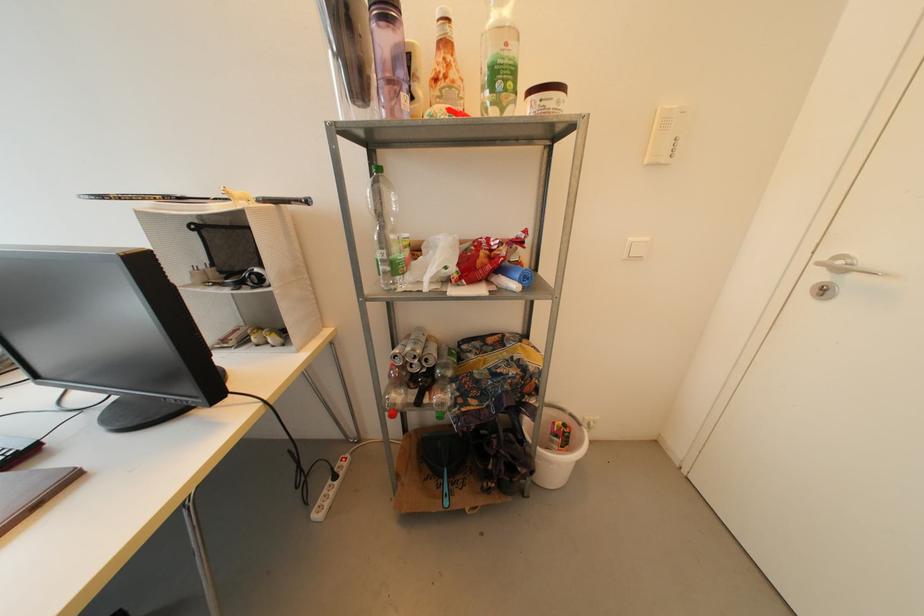
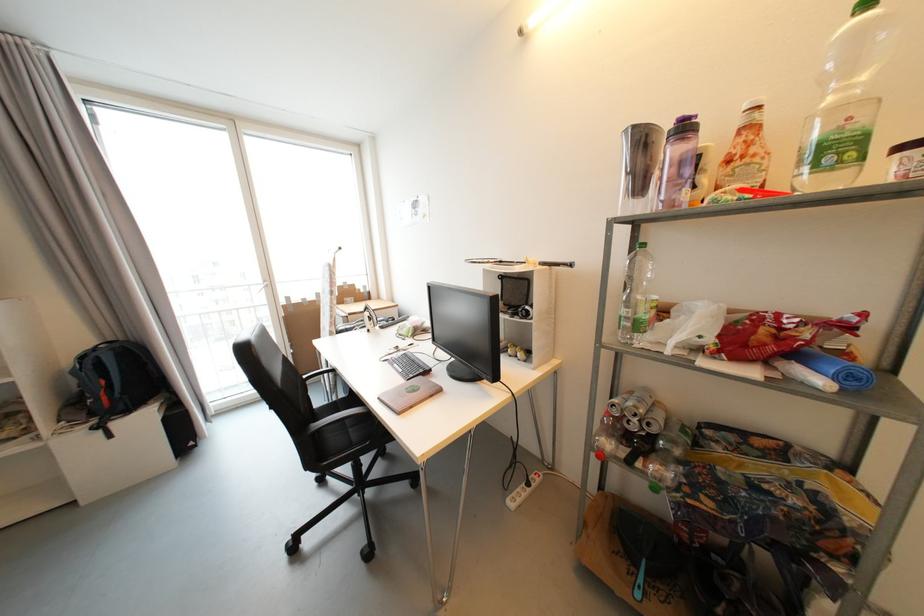
The point at (x=387, y=262) is marked in the first image. Where is the corresponding point in the second image?

(631, 320)